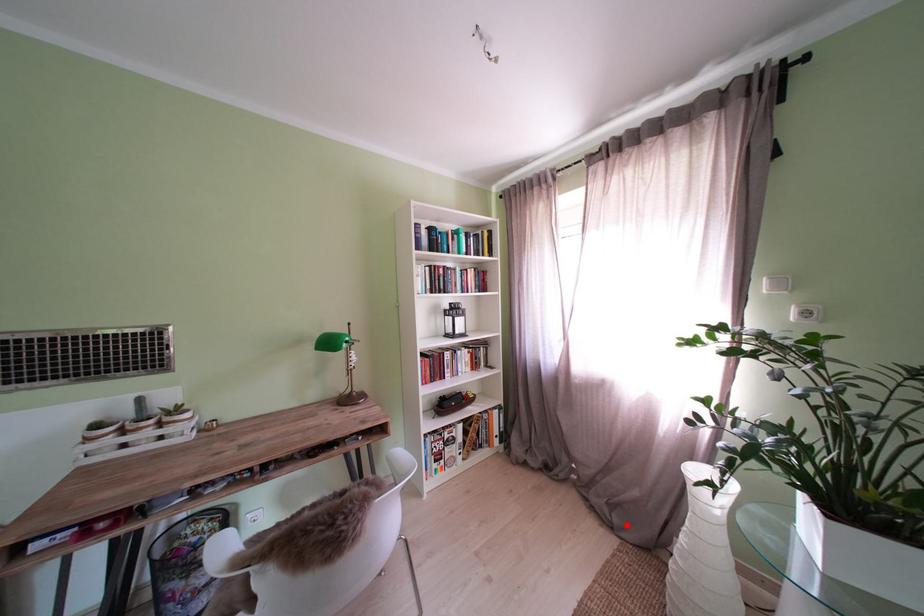
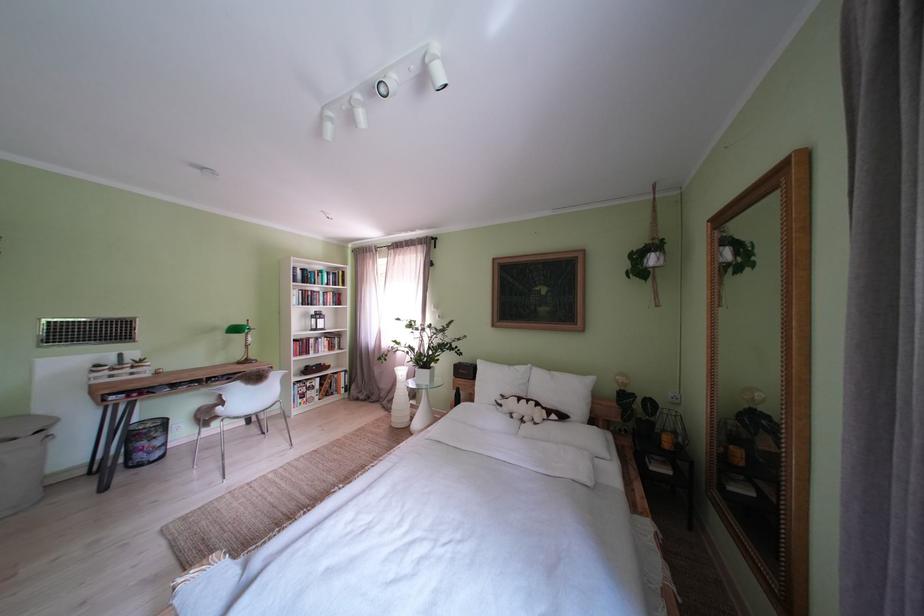
Question: I am providing you with two images of the same scene from different viewpoints. In image1, a red point is highlighted. Considering the same 3D point in image2, which of the following is correct?

Choices:
 (A) It is closer
 (B) It is farther

Answer: (B)